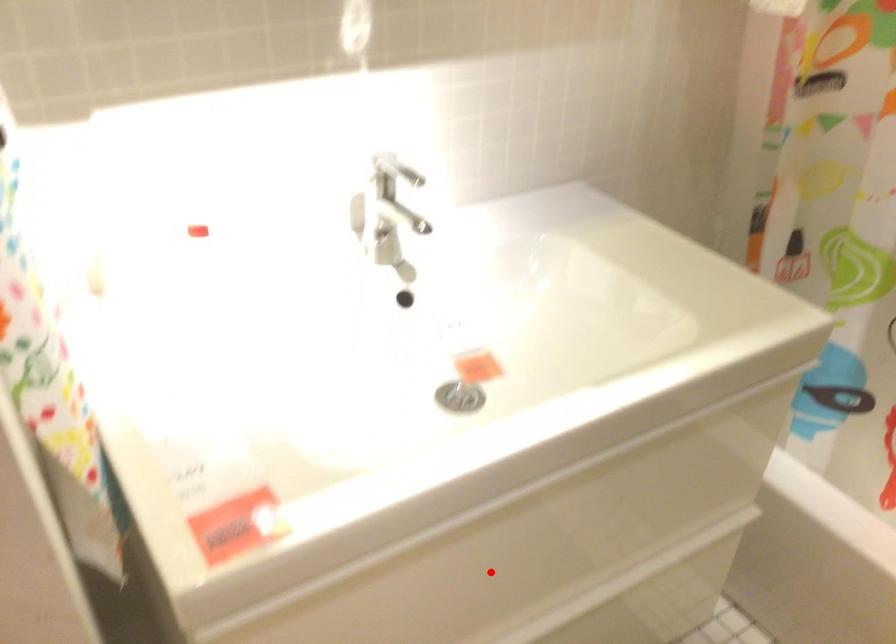
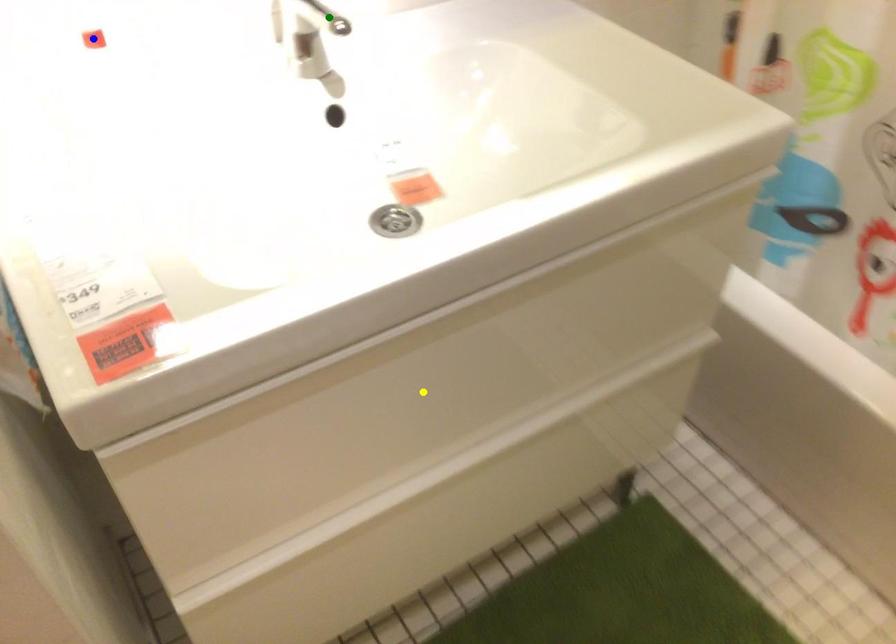
Question: I am providing you with two images of the same scene from different viewpoints. A red point is marked on the first image. You are given multiple points on the second image. In image 2, which mark is for the same physical point as the one in image 1?

Choices:
 (A) blue point
 (B) green point
 (C) yellow point

Answer: (C)